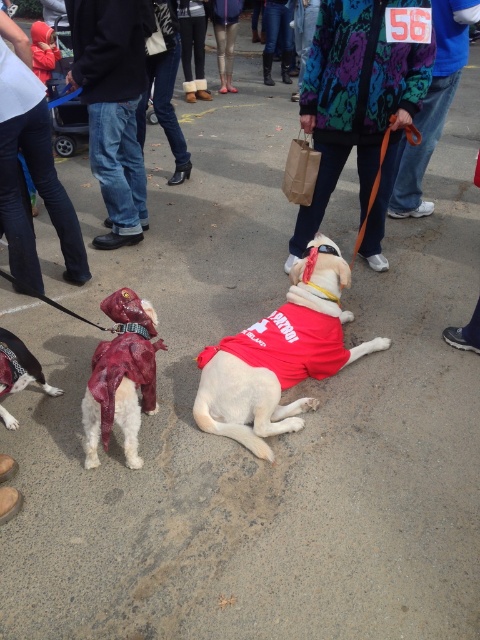
You are a photographer trying to capture a closeup of the shiny red fabric dog at left without including the denim pants at lower left in the frame. Given their relative sizes, can you position yourself in a way that allows you to focus solely on the dog?

The denim pants at lower left are wider than the shiny red fabric dog at left. Position yourself so that the denim pants are out of the camera frame while still capturing the dog. Since the pants are wider, you might need to angle the camera slightly away from the pants to avoid them while keeping the dog centered.